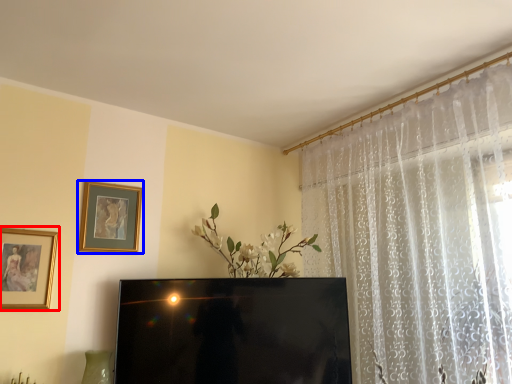
Question: Which object appears farthest to the camera in this image, picture frame (highlighted by a red box) or picture frame (highlighted by a blue box)?

Choices:
 (A) picture frame
 (B) picture frame

Answer: (B)